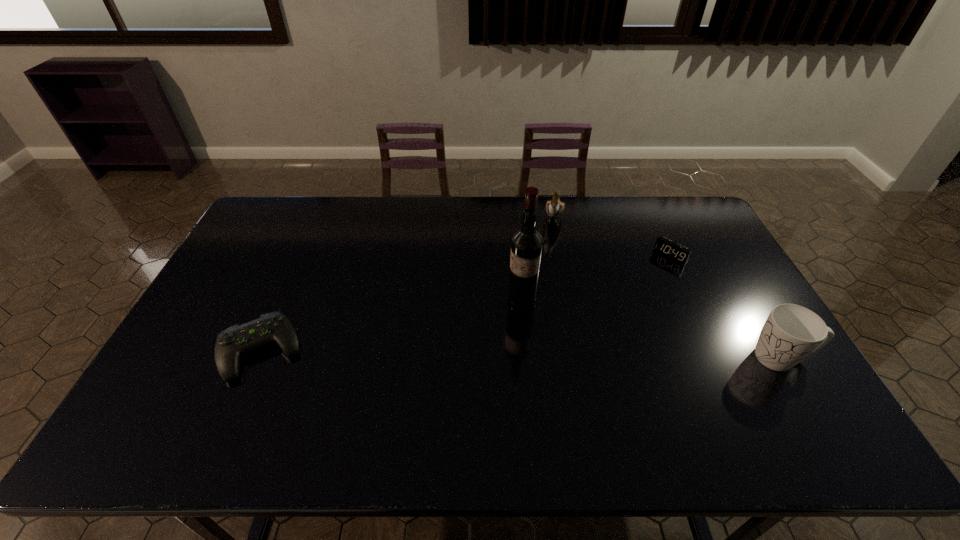
Find the location of a particular element. free space located on the side of the mug with the handle is located at coordinates (615, 357).

Where is `vacant position located on the side of the mug with the handle`? vacant position located on the side of the mug with the handle is located at coordinates (679, 357).

Locate an element on the screen. The width and height of the screenshot is (960, 540). free space located 0.130m at the face of the third object from right to left is located at coordinates (548, 257).

This screenshot has height=540, width=960. In order to click on free space located 0.280m at the face of the third object from right to left in this screenshot , I will do `click(540, 288)`.

Identify the location of vacant point located at the face of the third object from right to left. This screenshot has height=540, width=960. (550, 248).

Find the location of a particular element. vacant space located 0.090m on the front-facing side of the second farthest object is located at coordinates (650, 276).

Where is `vacant position located 0.310m on the front-facing side of the second farthest object`? The width and height of the screenshot is (960, 540). vacant position located 0.310m on the front-facing side of the second farthest object is located at coordinates tap(612, 314).

At what (x,y) coordinates should I click in order to perform the action: click on vacant region located on the front-facing side of the second farthest object. Please return your answer as a coordinate pair (x, y). This screenshot has height=540, width=960. Looking at the image, I should click on (599, 327).

Where is `vacant area situated on the front and back of the third farthest object`? vacant area situated on the front and back of the third farthest object is located at coordinates (422, 372).

What are the coordinates of `blank space located on the front and back of the third farthest object` in the screenshot? It's located at (487, 326).